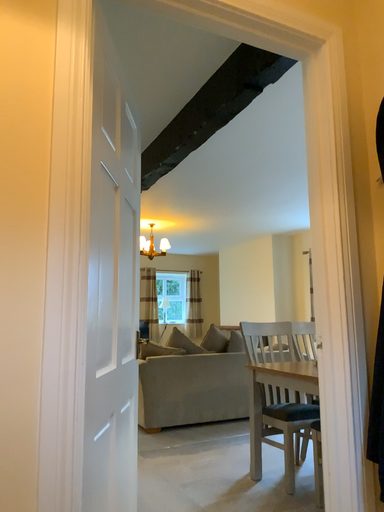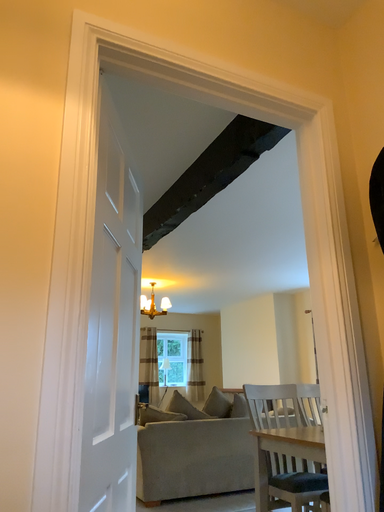
Question: How did the camera likely rotate when shooting the video?

Choices:
 (A) rotated upward
 (B) rotated downward

Answer: (A)